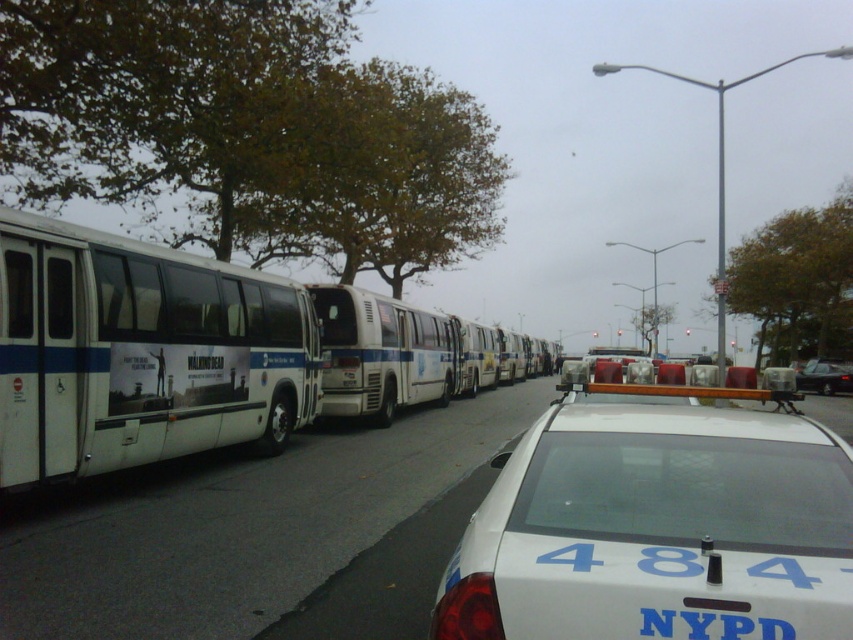
Is white glossy police car at lower right thinner than metallic silver sedan at center?

Yes.

Does white glossy police car at lower right come behind metallic silver sedan at center?

No, it is in front of metallic silver sedan at center.

This screenshot has height=640, width=853. Identify the location of white glossy police car at lower right. (657, 528).

Locate an element on the screen. Image resolution: width=853 pixels, height=640 pixels. white glossy police car at lower right is located at coordinates (657, 528).

Is white matte bus at left closer to the viewer compared to white matte bus at center?

Yes.

Is white matte bus at left above white matte bus at center?

Yes.

What are the coordinates of `white matte bus at left` in the screenshot? It's located at (140, 353).

What do you see at coordinates (381, 353) in the screenshot?
I see `white matte bus at center` at bounding box center [381, 353].

Which is more to the right, white matte bus at center or metallic silver sedan at center?

Positioned to the right is metallic silver sedan at center.

Does point (351, 340) come closer to viewer compared to point (839, 385)?

Yes.

At what (x,y) coordinates should I click in order to perform the action: click on white matte bus at center. Please return your answer as a coordinate pair (x, y). Looking at the image, I should click on (381, 353).